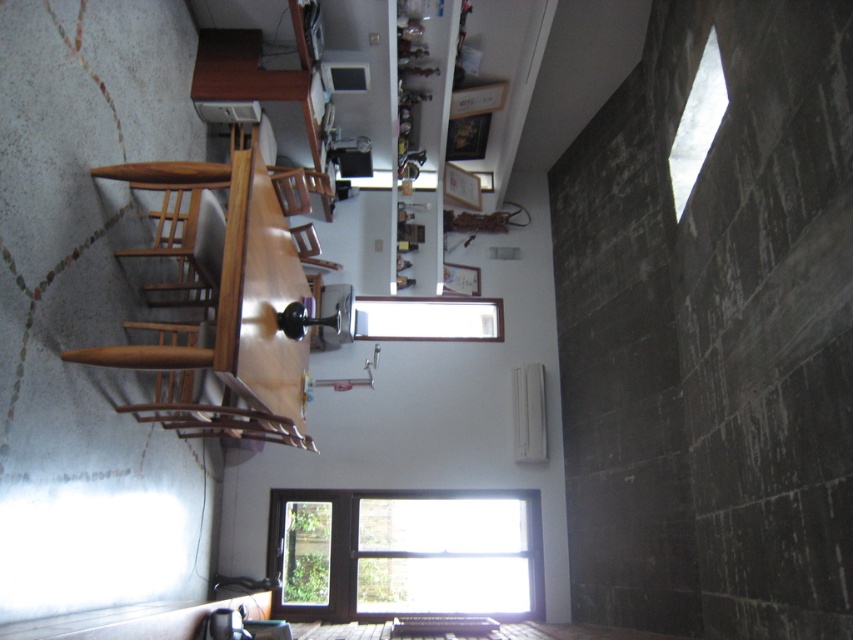
You are a painter who wants to hang a picture frame on the wall above the wooden chair at center. Based on the scene, can you determine if the clear glass window at upper center is in the way of where you want to hang the frame?

The clear glass window at upper center is above the wooden chair at center, so it would be in the way of hanging the picture frame there.

You are standing at the point marked as point (442, 490) in this dining area. You want to walk to the entrance door located at the opposite side of the room. If your walking speed is 3 feet per second, how many seconds will it take you to reach the door?

The distance between you and the door is 20.44 feet. At a speed of 3 feet per second, it will take approximately 6.81 seconds to reach the door.